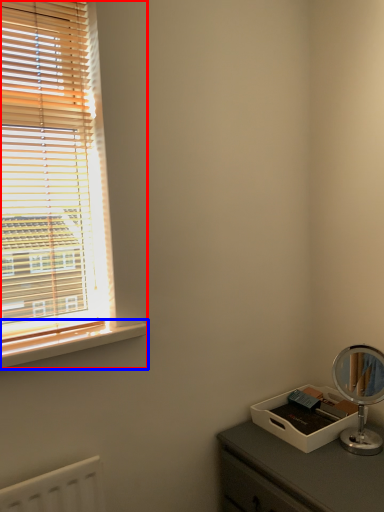
Question: Which of the following is the closest to the observer, window (highlighted by a red box) or window sill (highlighted by a blue box)?

Choices:
 (A) window
 (B) window sill

Answer: (A)